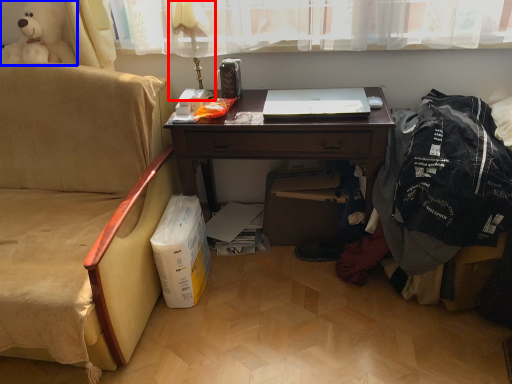
Question: Which of the following is the farthest to the observer, table lamp (highlighted by a red box) or toy (highlighted by a blue box)?

Choices:
 (A) table lamp
 (B) toy

Answer: (B)